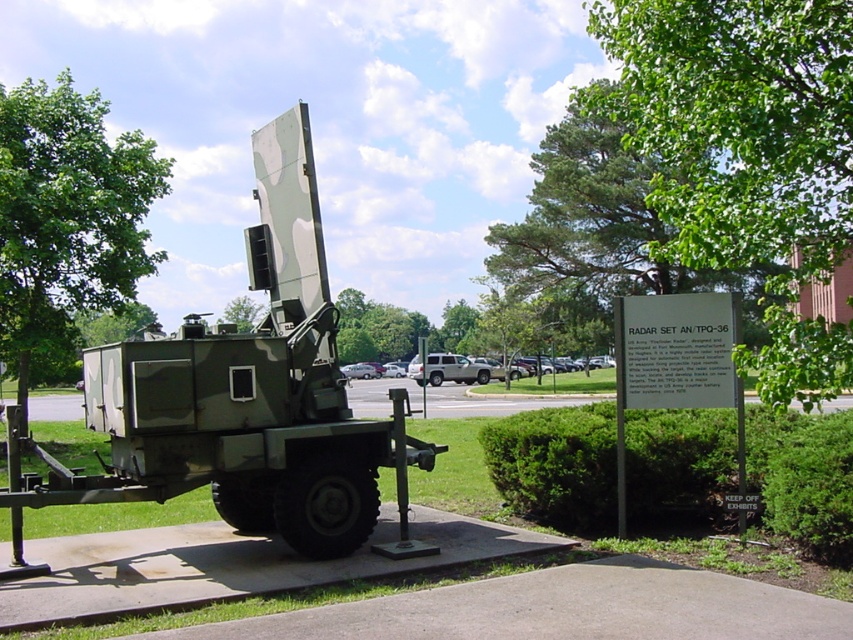
Question: Is camouflage painted radar set at center to the right of silver metallic suv at center from the viewer's perspective?

Choices:
 (A) no
 (B) yes

Answer: (B)

Question: Can you confirm if camouflage painted radar set at center is smaller than silver metallic suv at center?

Choices:
 (A) no
 (B) yes

Answer: (B)

Question: Which object is farther from the camera taking this photo?

Choices:
 (A) camouflage painted radar set at center
 (B) silver metallic suv at center

Answer: (B)

Question: Which point is farther from the camera taking this photo?

Choices:
 (A) (227, 413)
 (B) (426, 372)

Answer: (B)

Question: Does camouflage painted radar set at center have a larger size compared to silver metallic suv at center?

Choices:
 (A) yes
 (B) no

Answer: (B)

Question: Which of the following is the closest to the observer?

Choices:
 (A) (426, 380)
 (B) (97, 396)

Answer: (B)